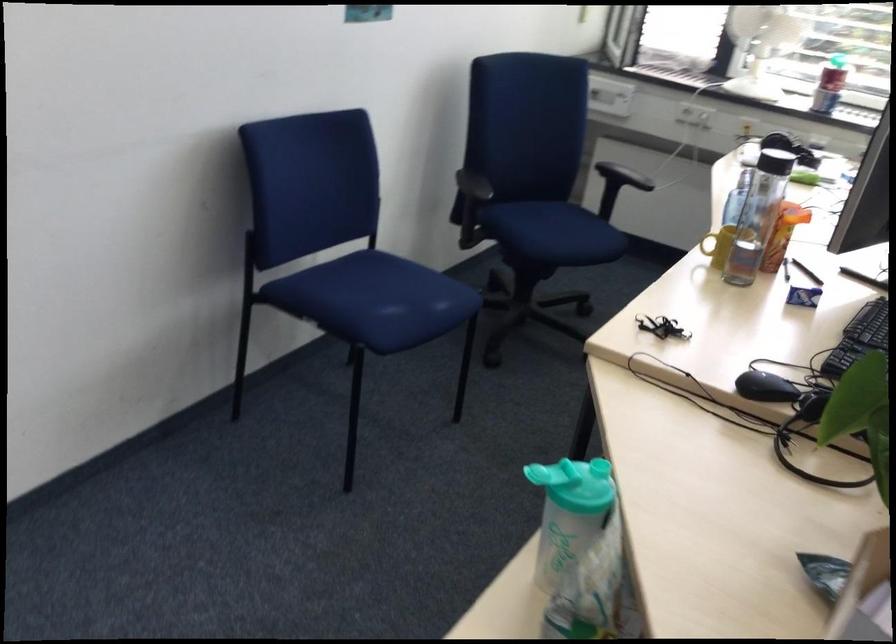
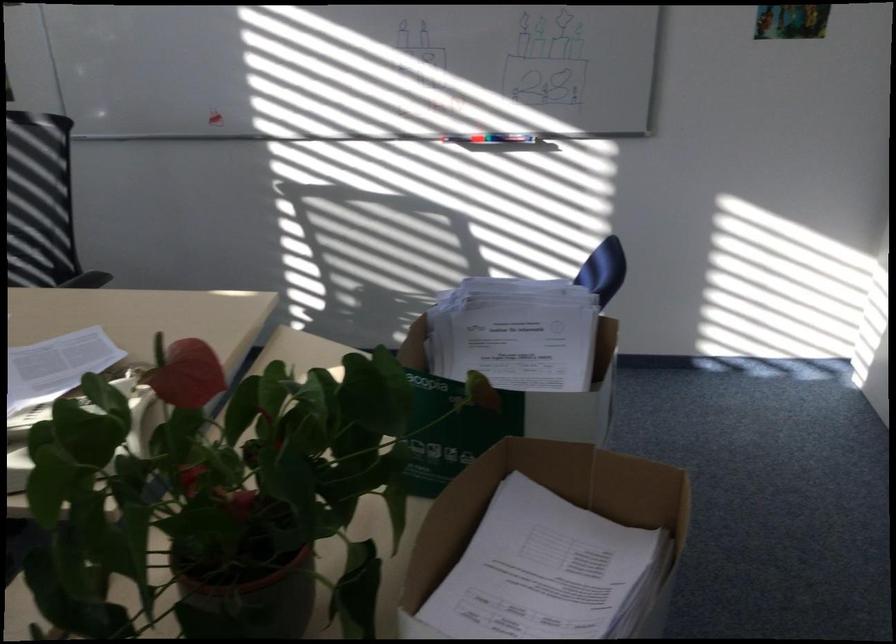
The first image is from the beginning of the video and the second image is from the end. How did the camera likely rotate when shooting the video?

The camera's rotation is toward right-down.